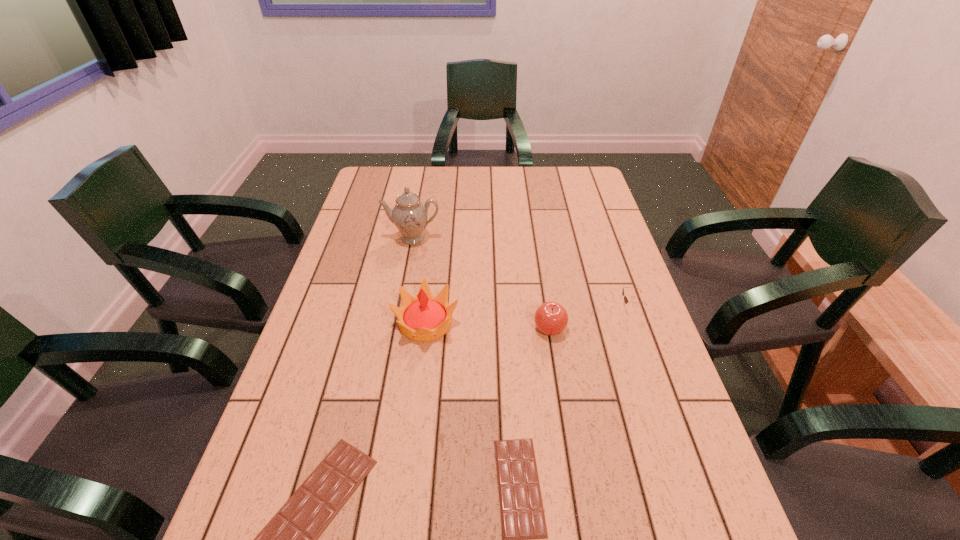
The width and height of the screenshot is (960, 540). I want to click on free space located 0.310m in front of the lenses of the sunglasses, so click(x=505, y=308).

What are the coordinates of `vacant space located in front of the lenses of the sunglasses` in the screenshot? It's located at (601, 308).

The height and width of the screenshot is (540, 960). In order to click on vacant point located 0.230m on the back of the crown in this screenshot , I will do `click(435, 248)`.

Image resolution: width=960 pixels, height=540 pixels. I want to click on object that is positioned at the left edge, so click(x=409, y=215).

You are a GUI agent. You are given a task and a screenshot of the screen. Output one action in this format:
    pyautogui.click(x=<x>, y=<y>)
    Task: Click on the object located in the right edge section of the desktop
    This screenshot has width=960, height=540.
    Given the screenshot: What is the action you would take?
    pyautogui.click(x=626, y=301)

Image resolution: width=960 pixels, height=540 pixels. What are the coordinates of `free space at the far edge` in the screenshot? It's located at (428, 167).

Where is `vacant space at the near edge of the desktop`? The height and width of the screenshot is (540, 960). vacant space at the near edge of the desktop is located at coordinates (423, 503).

This screenshot has width=960, height=540. In order to click on free point at the left edge in this screenshot , I will do pos(365,258).

Where is `free location at the right edge`? The height and width of the screenshot is (540, 960). free location at the right edge is located at coordinates (576, 242).

I want to click on free space at the far left corner of the desktop, so [x=404, y=183].